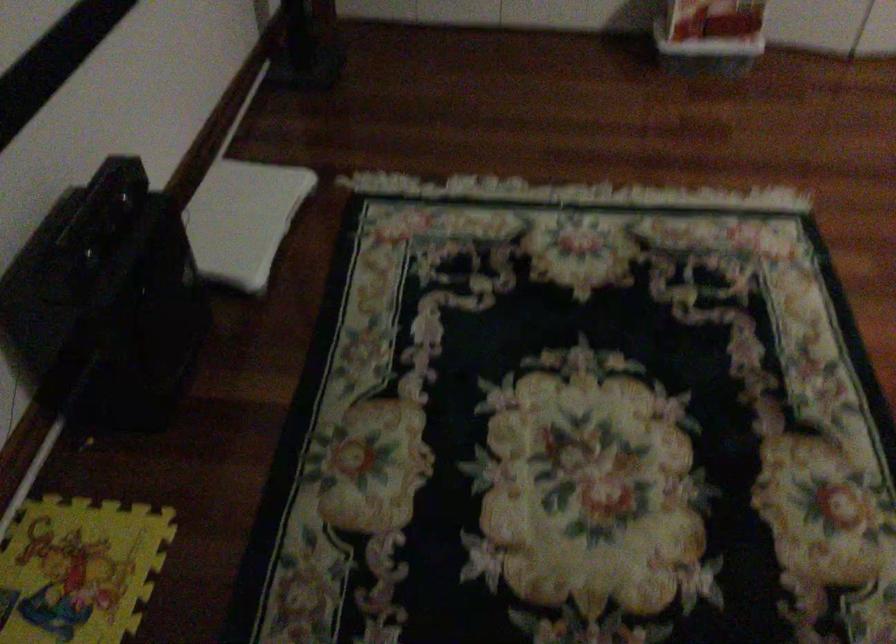
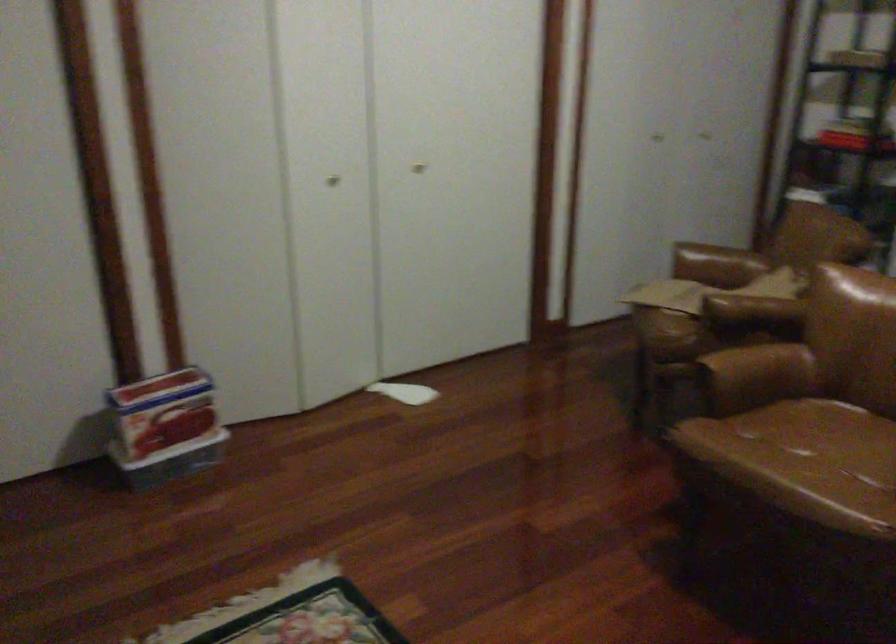
The images are taken continuously from a first-person perspective. In which direction is your viewpoint rotating?

The rotation direction of the camera is right-up.